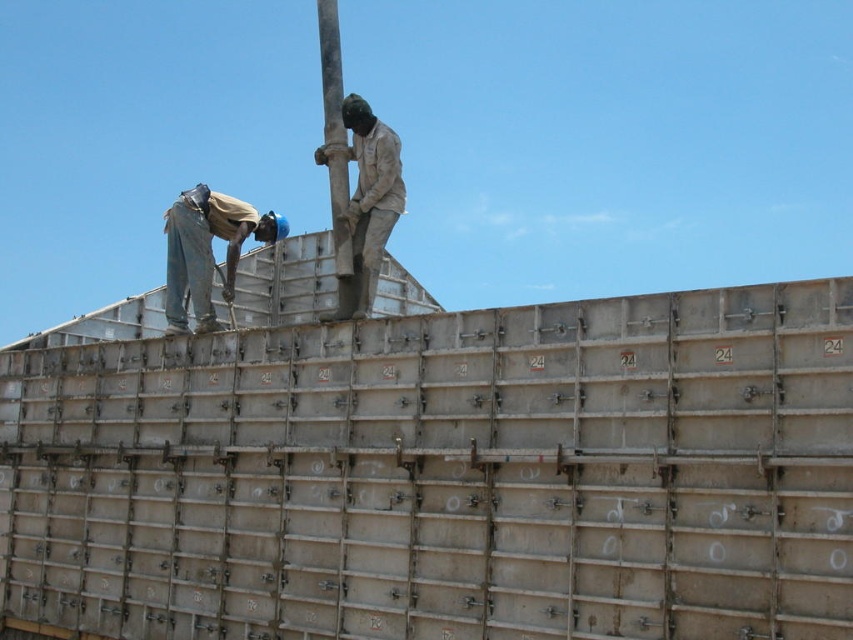
Looking at this image, you are a safety inspector assessing the construction site shown in the image. You notice the gray metallic panels at upper center and the brown denim jeans at upper left. Based on their heights, which object is taller?

The gray metallic panels at upper center are taller than the brown denim jeans at upper left according to the description.

You are a safety inspector reviewing the construction site. You notice the brown denim jeans at upper left and the smooth metallic pole at upper center. Which object is closer to you from your vantage point?

The brown denim jeans at upper left is closer to you because the smooth metallic pole at upper center is positioned behind it.